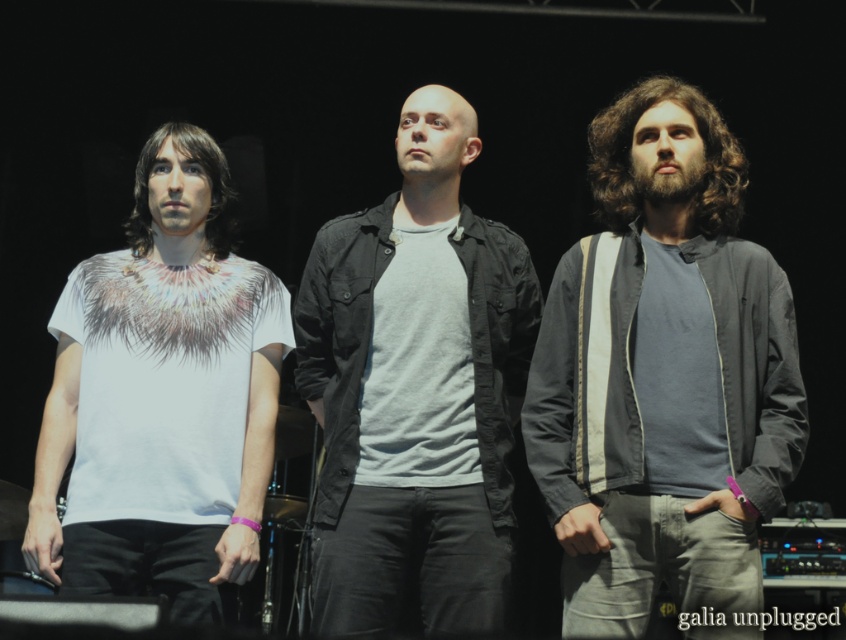
Question: Is matte black jacket at center in front of white printed t-shirt at left?

Choices:
 (A) no
 (B) yes

Answer: (A)

Question: Can you confirm if gray fabric jacket at right is wider than white printed t-shirt at left?

Choices:
 (A) no
 (B) yes

Answer: (B)

Question: Which object appears closest to the camera in this image?

Choices:
 (A) white printed t-shirt at left
 (B) matte black jacket at center
 (C) gray fabric jacket at right

Answer: (C)

Question: Among these points, which one is nearest to the camera?

Choices:
 (A) (702, 508)
 (B) (165, 333)
 (C) (416, 566)

Answer: (A)

Question: Which of the following is the closest to the observer?

Choices:
 (A) gray fabric jacket at right
 (B) matte black jacket at center
 (C) white printed t-shirt at left

Answer: (A)

Question: Does matte black jacket at center appear under white printed t-shirt at left?

Choices:
 (A) no
 (B) yes

Answer: (A)